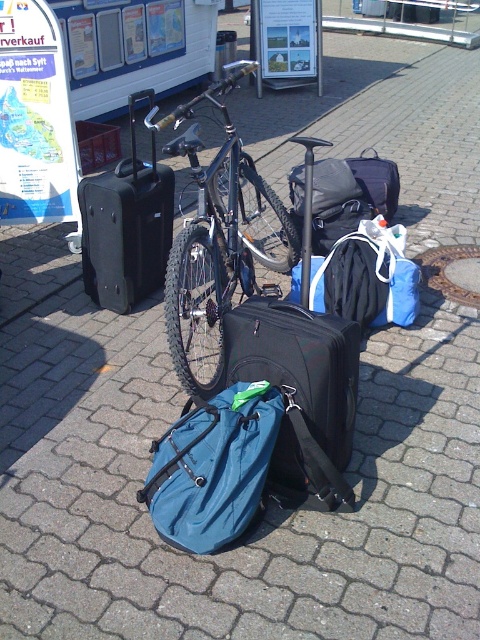
You are standing at the transportation hub and need to retrieve your teal fabric backpack at center and black hardshell suitcase at center. Which item is closer to the ground?

The teal fabric backpack at center is closer to the ground since it is located below the black hardshell suitcase at center.

You are a delivery person who needs to retrieve your teal fabric backpack at center. The shiny black bicycle at center is blocking your path. Can you move the bicycle to access your backpack?

The teal fabric backpack at center is behind the shiny black bicycle at center, so you can move the bicycle to access it.